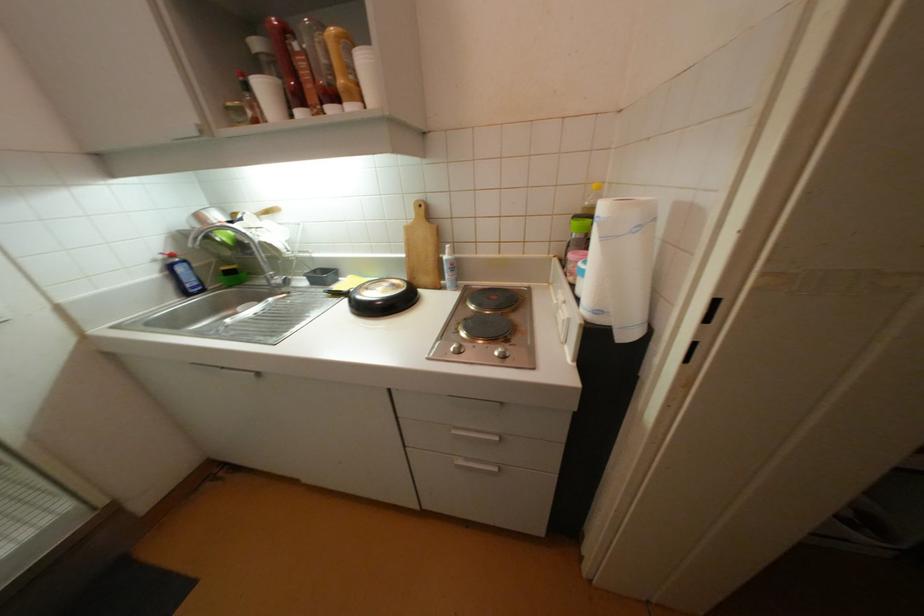
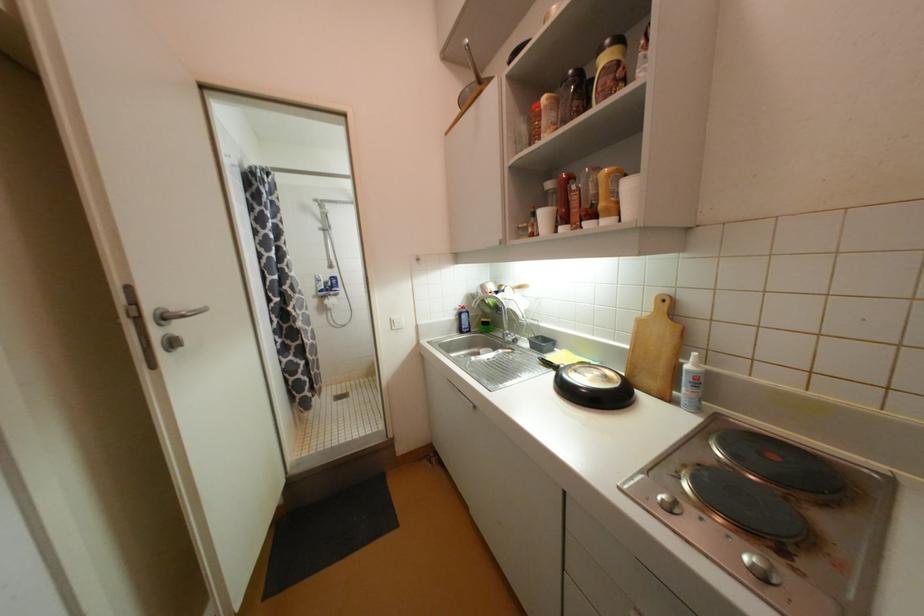
Locate, in the second image, the point that corresponds to (x=508, y=358) in the first image.

(768, 578)